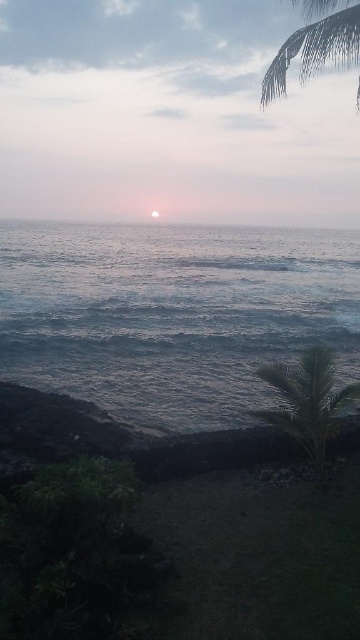
Question: Which point is farther to the camera?

Choices:
 (A) (308, 426)
 (B) (357, 88)
 (C) (66, 305)

Answer: (B)

Question: Does grayish-blue water at center have a lesser width compared to green leafy palm at upper right?

Choices:
 (A) no
 (B) yes

Answer: (B)

Question: Can you confirm if green leafy palm tree at lower right is smaller than green leafy palm at upper right?

Choices:
 (A) yes
 (B) no

Answer: (A)

Question: Does grayish-blue water at center appear on the right side of green leafy palm at upper right?

Choices:
 (A) yes
 (B) no

Answer: (B)

Question: Which object is closer to the camera taking this photo?

Choices:
 (A) grayish-blue water at center
 (B) green leafy palm at upper right

Answer: (B)

Question: Among these points, which one is nearest to the camera?

Choices:
 (A) pos(291,429)
 (B) pos(318,1)
 (C) pos(223,259)

Answer: (A)